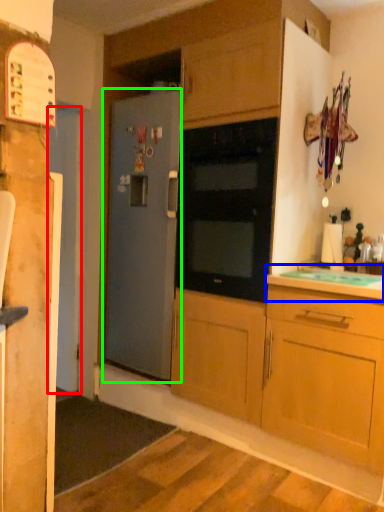
Question: Which is nearer to the door (highlighted by a red box)? countertop (highlighted by a blue box) or refrigerator (highlighted by a green box).

Choices:
 (A) countertop
 (B) refrigerator

Answer: (B)